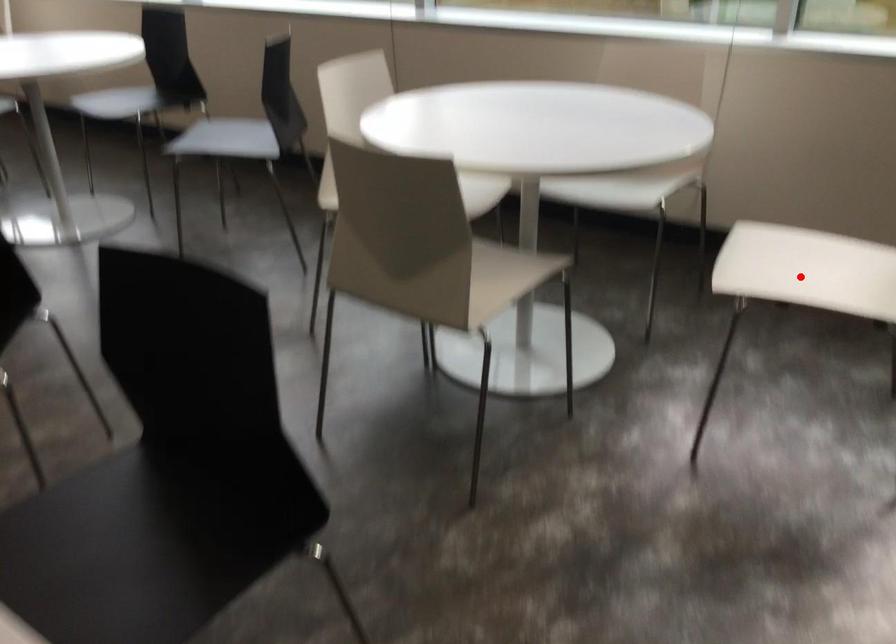
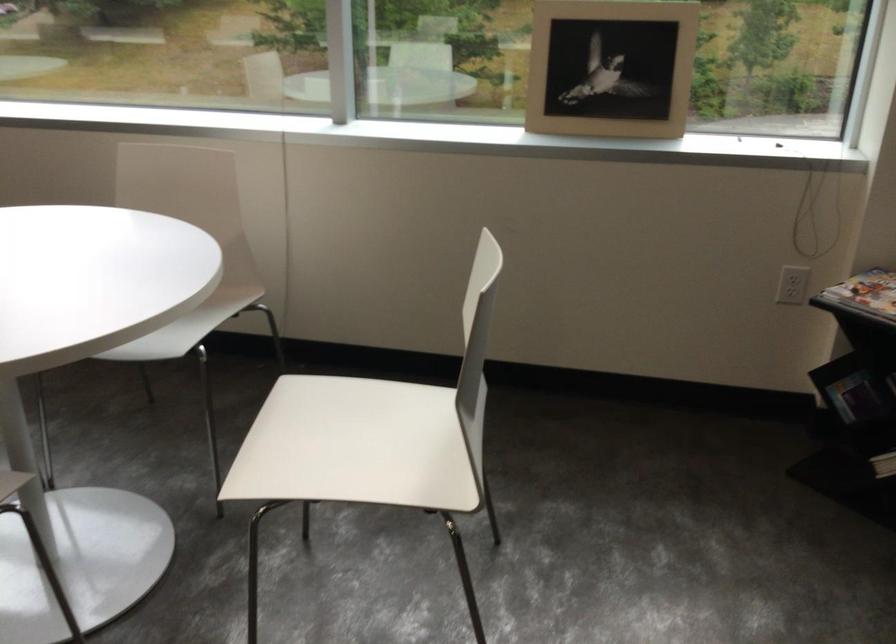
The point at the highlighted location is marked in the first image. Where is the corresponding point in the second image?

(356, 446)